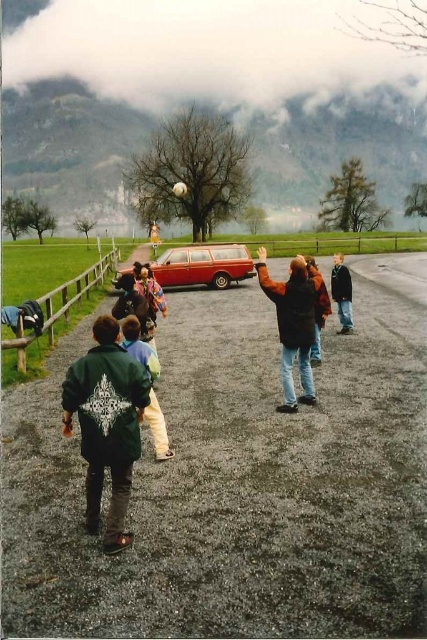
Question: Which object is farther from the camera taking this photo?

Choices:
 (A) shiny red station wagon at center
 (B) green fuzzy jacket at lower left
 (C) green fleece jacket at lower left

Answer: (A)

Question: Which point is farther to the camera?

Choices:
 (A) (196, 269)
 (B) (123, 342)
 (C) (104, 456)

Answer: (A)

Question: Does green fuzzy jacket at lower left come in front of shiny red station wagon at center?

Choices:
 (A) yes
 (B) no

Answer: (A)

Question: Does green fuzzy jacket at lower left have a lesser width compared to shiny red station wagon at center?

Choices:
 (A) yes
 (B) no

Answer: (A)

Question: Is the position of shiny red station wagon at center less distant than that of green fleece jacket at lower left?

Choices:
 (A) no
 (B) yes

Answer: (A)

Question: Among these points, which one is farthest from the camera?

Choices:
 (A) (286, 412)
 (B) (157, 376)
 (C) (119, 440)
 (D) (195, 280)

Answer: (D)